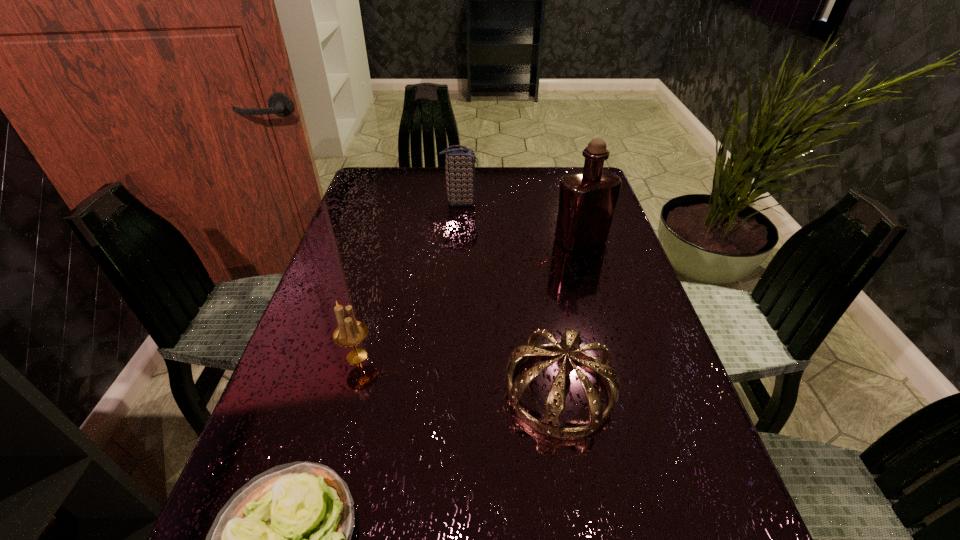
Where is `the tallest object`? This screenshot has height=540, width=960. the tallest object is located at coordinates (587, 200).

What are the coordinates of `the second farthest object` in the screenshot? It's located at (587, 200).

Find the location of a particular element. the third object from right to left is located at coordinates (460, 163).

Image resolution: width=960 pixels, height=540 pixels. I want to click on the farthest object, so click(x=460, y=163).

Locate an element on the screen. candle holder is located at coordinates (349, 333).

The image size is (960, 540). Find the location of `tiara`. tiara is located at coordinates (549, 425).

At what (x,y) coordinates should I click in order to perform the action: click on vacant space located 0.190m on the back of the liquor. Please return your answer as a coordinate pair (x, y). The height and width of the screenshot is (540, 960). Looking at the image, I should click on (567, 194).

Identify the location of vacant space located 0.180m with the zip open on the farthest object. pos(537,202).

At what (x,y) coordinates should I click in order to perform the action: click on blank area located on the right of the candle holder. Please return your answer as a coordinate pair (x, y). Looking at the image, I should click on (563, 356).

Find the location of a particular element. vacant space located 0.320m on the back of the tiara is located at coordinates (538, 255).